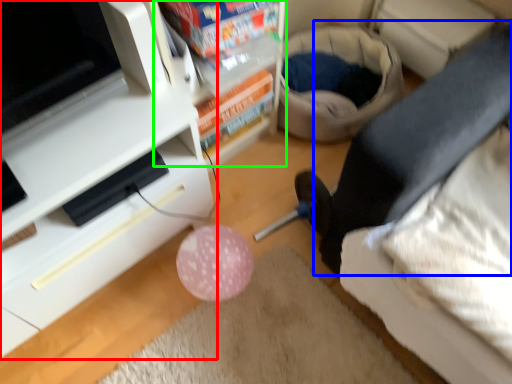
Question: Which is nearer to the furniture (highlighted by a red box)? leg (highlighted by a blue box) or shelf (highlighted by a green box).

Choices:
 (A) leg
 (B) shelf

Answer: (B)